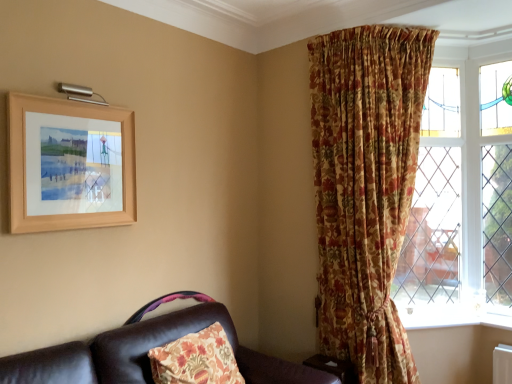
Question: From the image's perspective, relative to wooden frame at upper left, is white painted wood at lower right above or below?

Choices:
 (A) above
 (B) below

Answer: (B)

Question: Is white painted wood at lower right bigger or smaller than wooden frame at upper left?

Choices:
 (A) small
 (B) big

Answer: (A)

Question: Which of these objects is positioned closest to the wooden frame at upper left?

Choices:
 (A) white painted wood at lower right
 (B) leather couch at lower left
 (C) floral fabric curtain at upper right

Answer: (B)

Question: Which object is the farthest from the leather couch at lower left?

Choices:
 (A) wooden frame at upper left
 (B) white painted wood at lower right
 (C) floral fabric curtain at upper right

Answer: (B)